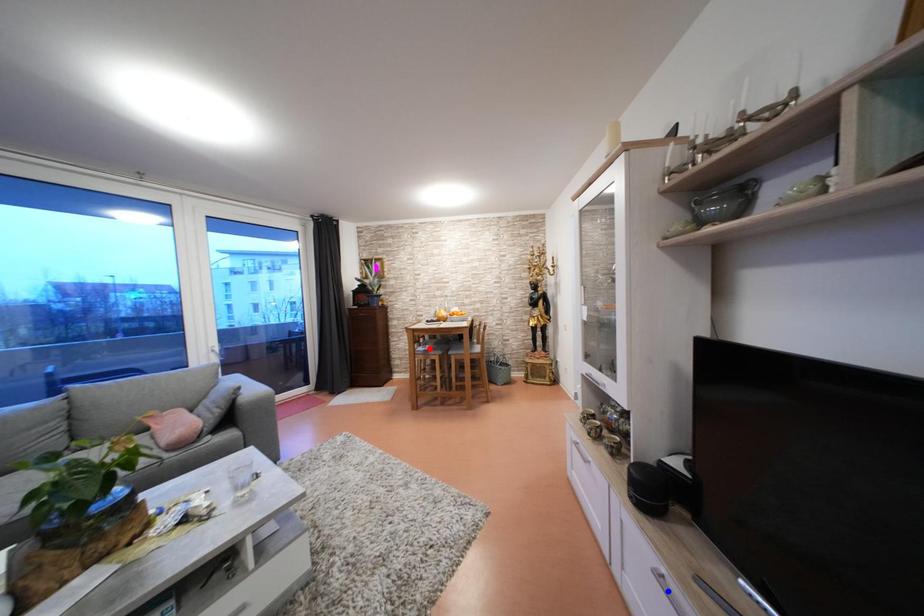
Question: In the image, two points are highlighted. Which point is nearer to the camera? Reply with the corresponding letter.

Choices:
 (A) blue point
 (B) red point

Answer: (A)